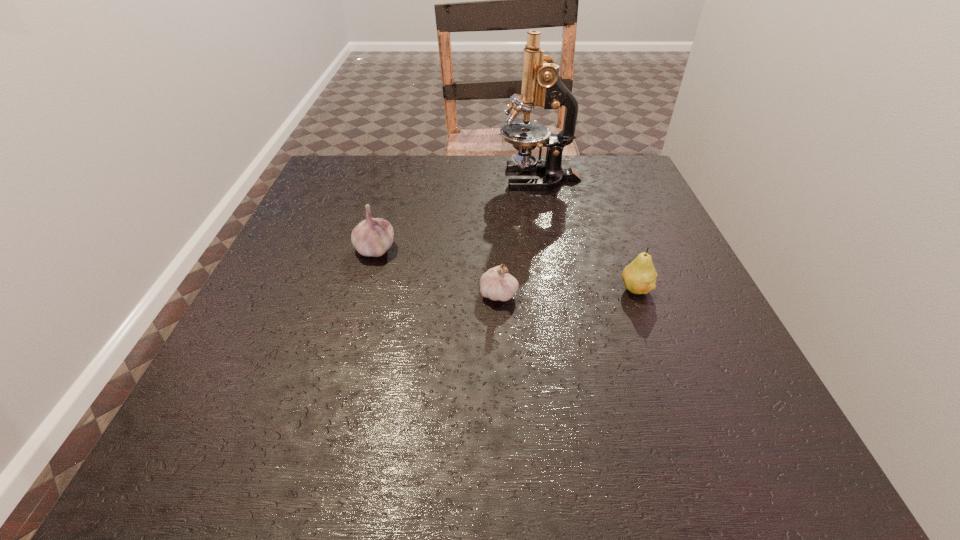
Where is `free region at the right edge of the desktop`? This screenshot has height=540, width=960. free region at the right edge of the desktop is located at coordinates (664, 393).

Image resolution: width=960 pixels, height=540 pixels. In order to click on vacant region at the far left corner in this screenshot , I will do click(361, 188).

Identify the location of free space at the near left corner of the desktop. The height and width of the screenshot is (540, 960). (256, 428).

The height and width of the screenshot is (540, 960). Identify the location of free space at the far right corner of the desktop. (617, 164).

At what (x,y) coordinates should I click in order to perform the action: click on blank space at the near right corner of the desktop. Please return your answer as a coordinate pair (x, y). The width and height of the screenshot is (960, 540). Looking at the image, I should click on (674, 446).

This screenshot has height=540, width=960. I want to click on unoccupied area between the shorter garlic and the rightmost object, so click(566, 291).

Locate an element on the screen. Image resolution: width=960 pixels, height=540 pixels. empty space between the shortest object and the rightmost object is located at coordinates (566, 291).

You are a GUI agent. You are given a task and a screenshot of the screen. Output one action in this format:
    pyautogui.click(x=<x>, y=<y>)
    Task: Click on the vacant space in between the microscope and the left garlic
    Image resolution: width=960 pixels, height=540 pixels.
    Given the screenshot: What is the action you would take?
    pyautogui.click(x=457, y=213)

Find the location of a particular element. The image size is (960, 540). empty space that is in between the rightmost object and the shorter garlic is located at coordinates (566, 291).

The height and width of the screenshot is (540, 960). What are the coordinates of `free space between the shorter garlic and the pear` in the screenshot? It's located at (566, 291).